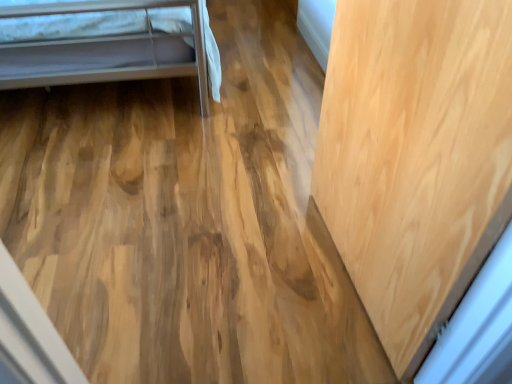
Where is `vacant location behind light wood door at right`? The height and width of the screenshot is (384, 512). vacant location behind light wood door at right is located at coordinates (278, 178).